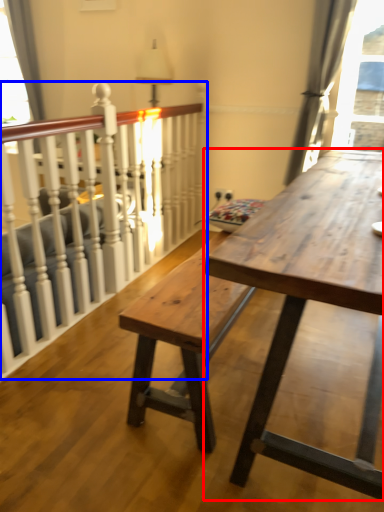
Question: Which point is closer to the camera, table (highlighted by a red box) or rail (highlighted by a blue box)?

Choices:
 (A) table
 (B) rail

Answer: (A)